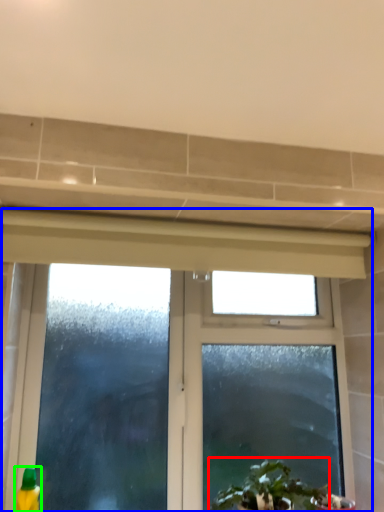
Question: Which object is the closest to the houseplant (highlighted by a red box)? Choose among these: window (highlighted by a blue box) or cleaning product (highlighted by a green box).

Choices:
 (A) window
 (B) cleaning product

Answer: (A)